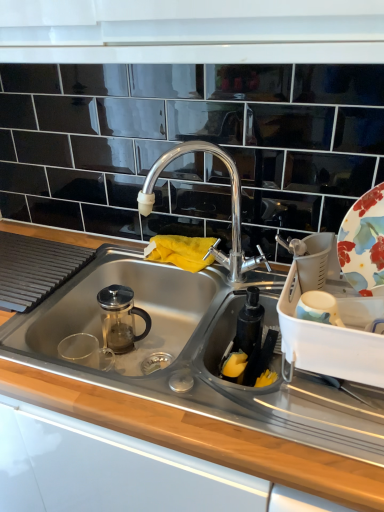
Question: Could polished chrome faucet at center be considered to be inside stainless steel sink at center?

Choices:
 (A) yes
 (B) no

Answer: (B)

Question: From a real-world perspective, is stainless steel sink at center physically below polished chrome faucet at center?

Choices:
 (A) no
 (B) yes

Answer: (B)

Question: Is stainless steel sink at center facing towards polished chrome faucet at center?

Choices:
 (A) no
 (B) yes

Answer: (A)

Question: Is stainless steel sink at center to the left of polished chrome faucet at center from the viewer's perspective?

Choices:
 (A) no
 (B) yes

Answer: (B)

Question: Is stainless steel sink at center completely or partially outside of polished chrome faucet at center?

Choices:
 (A) no
 (B) yes

Answer: (B)

Question: In the image, is stainless steel sink at center positioned in front of or behind polished chrome faucet at center?

Choices:
 (A) front
 (B) behind

Answer: (A)

Question: From a real-world perspective, is stainless steel sink at center positioned above or below polished chrome faucet at center?

Choices:
 (A) above
 (B) below

Answer: (B)

Question: Considering the positions of stainless steel sink at center and polished chrome faucet at center in the image, is stainless steel sink at center bigger or smaller than polished chrome faucet at center?

Choices:
 (A) small
 (B) big

Answer: (B)

Question: In terms of height, does stainless steel sink at center look taller or shorter compared to polished chrome faucet at center?

Choices:
 (A) short
 (B) tall

Answer: (A)

Question: From the image's perspective, is polished chrome faucet at center located above or below stainless steel sink at center?

Choices:
 (A) below
 (B) above

Answer: (B)

Question: Based on their sizes in the image, would you say polished chrome faucet at center is bigger or smaller than stainless steel sink at center?

Choices:
 (A) small
 (B) big

Answer: (A)

Question: From a real-world perspective, relative to stainless steel sink at center, is polished chrome faucet at center vertically above or below?

Choices:
 (A) below
 (B) above

Answer: (B)

Question: Is polished chrome faucet at center in front of or behind stainless steel sink at center in the image?

Choices:
 (A) front
 (B) behind

Answer: (B)

Question: Is point tap(357, 223) closer or farther from the camera than point tap(77, 322)?

Choices:
 (A) closer
 (B) farther

Answer: (A)

Question: In terms of width, does floral ceramic platter at right look wider or thinner when compared to stainless steel sink at center?

Choices:
 (A) wide
 (B) thin

Answer: (B)